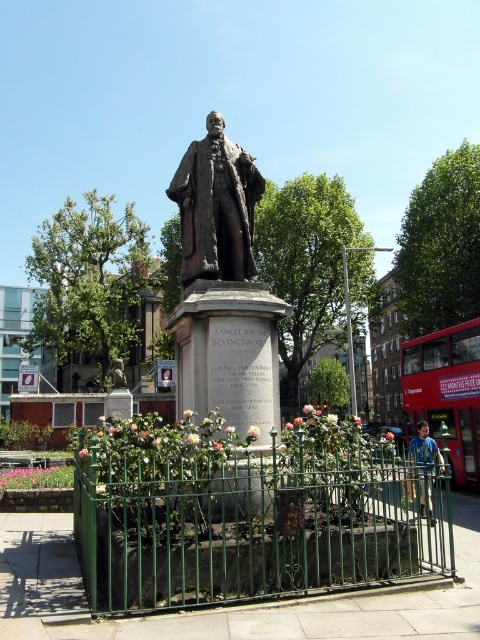
Question: Considering the real-world distances, which object is farthest from the bronze statue at center?

Choices:
 (A) red rubber double-decker bus at right
 (B) blue cotton shirt at lower right

Answer: (A)

Question: Observing the image, what is the correct spatial positioning of green wrought iron fence at lower center in reference to bronze statue at center?

Choices:
 (A) below
 (B) above

Answer: (A)

Question: Which is farther from the green wrought iron fence at lower center?

Choices:
 (A) bronze statue at center
 (B) blue cotton shirt at lower right

Answer: (A)

Question: Which object is positioned closest to the red rubber double-decker bus at right?

Choices:
 (A) bronze statue at center
 (B) green wrought iron fence at lower center
 (C) blue cotton shirt at lower right

Answer: (C)

Question: Does red rubber double-decker bus at right appear over blue cotton shirt at lower right?

Choices:
 (A) no
 (B) yes

Answer: (B)

Question: In this image, where is green wrought iron fence at lower center located relative to blue cotton shirt at lower right?

Choices:
 (A) above
 (B) below

Answer: (A)